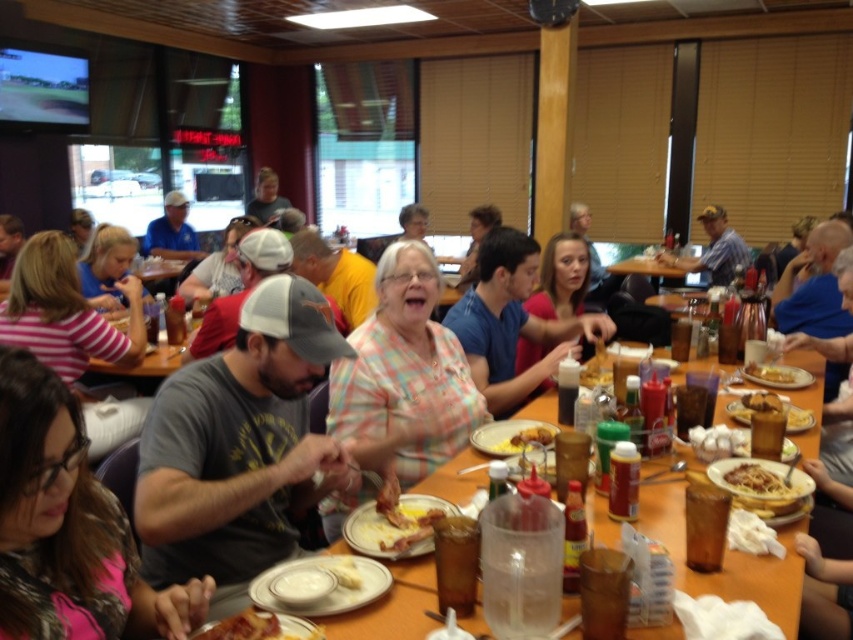
Question: Does gray cotton t-shirt at center have a larger size compared to matte white plate at center?

Choices:
 (A) no
 (B) yes

Answer: (B)

Question: Which point appears closest to the camera in this image?

Choices:
 (A) (714, 262)
 (B) (763, 378)
 (C) (38, 602)
 (D) (228, 621)

Answer: (C)

Question: Which object is farther from the camera taking this photo?

Choices:
 (A) matte blue shirt at upper left
 (B) striped cotton shirt at center
 (C) shiny brown pasta at center

Answer: (A)

Question: Where is brown wood table at center located in relation to golden crispy fries at center in the image?

Choices:
 (A) right
 (B) left

Answer: (B)

Question: Can you confirm if blue shirt at center is positioned above golden crispy chicken at center?

Choices:
 (A) yes
 (B) no

Answer: (A)

Question: Which point is farther from the camera taking this photo?

Choices:
 (A) (177, 346)
 (B) (323, 490)
 (C) (276, 208)
 (D) (354, 605)

Answer: (C)